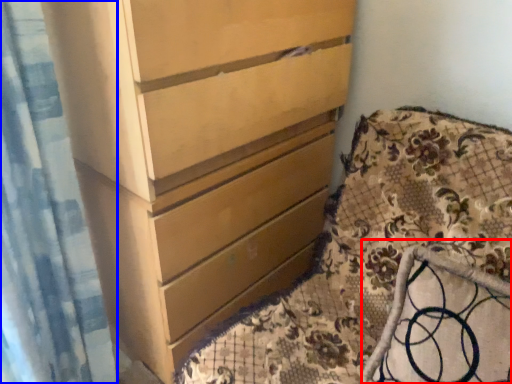
Question: Which of the following is the farthest to the observer, rocking chair (highlighted by a red box) or shower curtain (highlighted by a blue box)?

Choices:
 (A) rocking chair
 (B) shower curtain

Answer: (B)